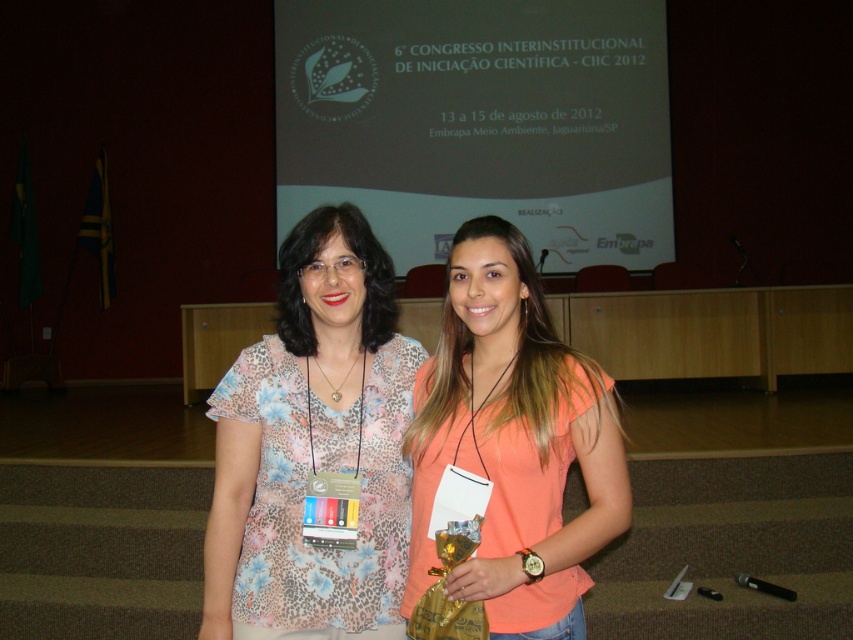
Is matte white projector screen at upper center further to camera compared to orange matte shirt at center?

Yes, it is.

Does matte white projector screen at upper center have a greater width compared to orange matte shirt at center?

Yes.

Which is behind, point (316, 38) or point (498, 288)?

The point (316, 38) is behind.

Where is `matte white projector screen at upper center`? matte white projector screen at upper center is located at coordinates (479, 122).

Between floral print blouse at center and orange matte shirt at center, which one is positioned higher?

floral print blouse at center

Does floral print blouse at center have a lesser width compared to orange matte shirt at center?

No, floral print blouse at center is not thinner than orange matte shirt at center.

Find the location of `floral print blouse at center`. floral print blouse at center is located at coordinates (314, 445).

How distant is matte white projector screen at upper center from floral print blouse at center?

A distance of 20.47 feet exists between matte white projector screen at upper center and floral print blouse at center.

Is matte white projector screen at upper center further to the viewer compared to floral print blouse at center?

That is True.

What do you see at coordinates (479, 122) in the screenshot?
I see `matte white projector screen at upper center` at bounding box center [479, 122].

At what (x,y) coordinates should I click in order to perform the action: click on matte white projector screen at upper center. Please return your answer as a coordinate pair (x, y). Looking at the image, I should click on 479,122.